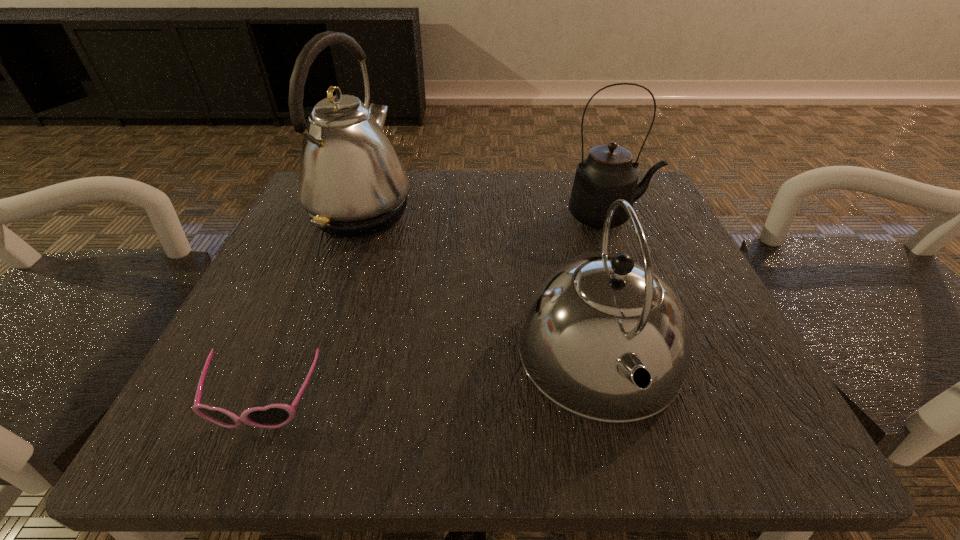
Identify the location of the tallest kettle. The width and height of the screenshot is (960, 540). (352, 183).

Where is `the leftmost kettle`? the leftmost kettle is located at coordinates (352, 183).

At what (x,y) coordinates should I click in order to perform the action: click on the nearest kettle. Please return your answer as a coordinate pair (x, y). The height and width of the screenshot is (540, 960). Looking at the image, I should click on (605, 338).

Identify the location of the shortest object. (272, 416).

At what (x,y) coordinates should I click in order to perform the action: click on vacant position located on the right of the tallest object. Please return your answer as a coordinate pair (x, y). Image resolution: width=960 pixels, height=540 pixels. Looking at the image, I should click on (596, 212).

At what (x,y) coordinates should I click in order to perform the action: click on kettle that is positioned at the near edge. Please return your answer as a coordinate pair (x, y). This screenshot has height=540, width=960. Looking at the image, I should click on (605, 338).

The height and width of the screenshot is (540, 960). What are the coordinates of `sunglasses that is at the near edge` in the screenshot? It's located at (272, 416).

This screenshot has height=540, width=960. In order to click on kettle at the left edge in this screenshot , I will do `click(352, 183)`.

Locate an element on the screen. sunglasses that is at the left edge is located at coordinates (272, 416).

At what (x,y) coordinates should I click in order to perform the action: click on object positioned at the far left corner. Please return your answer as a coordinate pair (x, y). Looking at the image, I should click on click(352, 183).